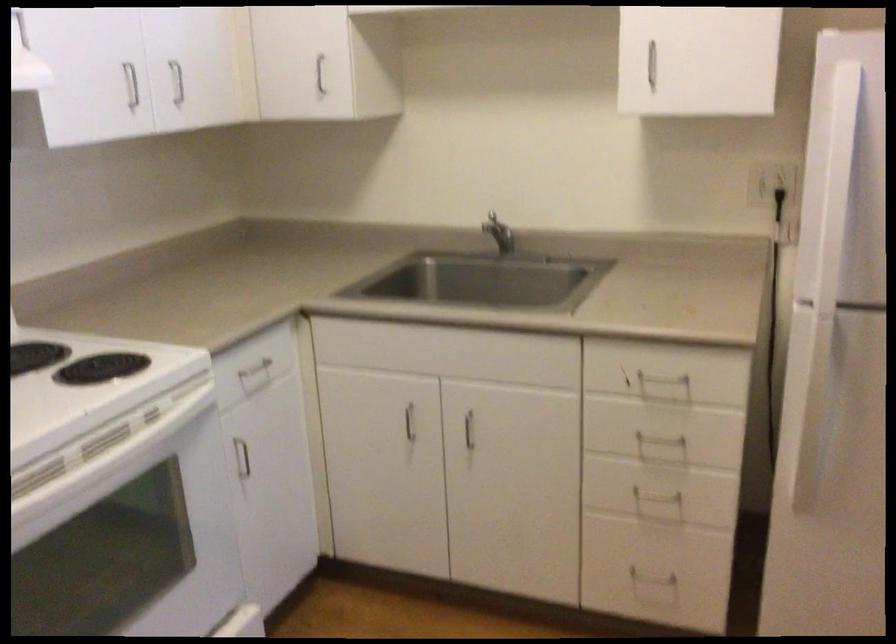
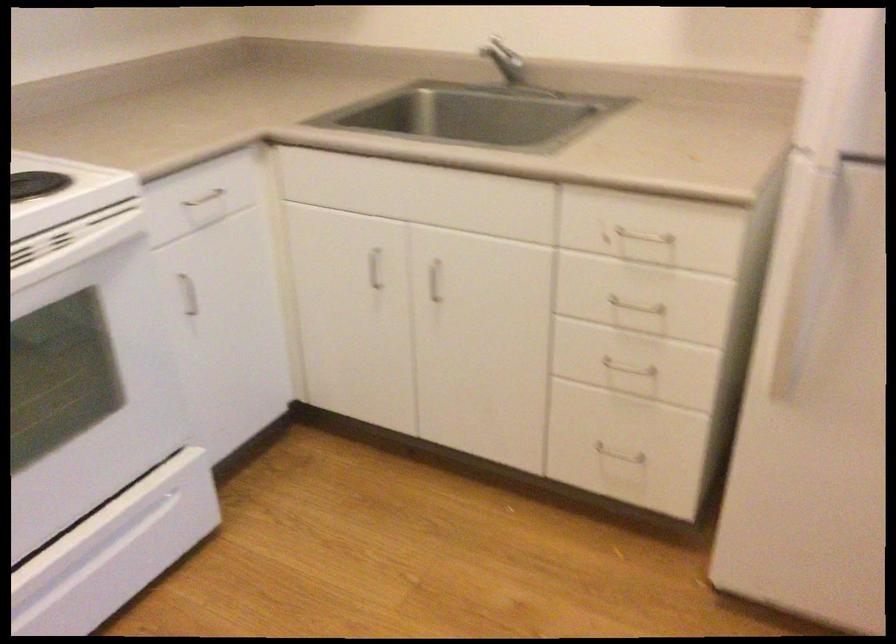
Find the pixel in the second image that matches (159,422) in the first image.

(73, 243)